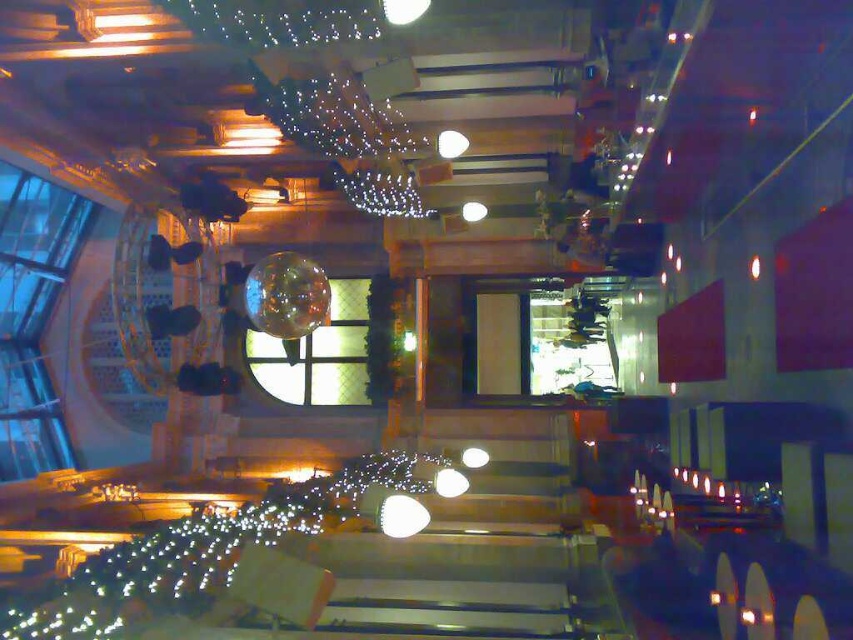
Question: Is illuminated string lights at center to the left of clear glass window at center from the viewer's perspective?

Choices:
 (A) yes
 (B) no

Answer: (B)

Question: Does illuminated string lights at center have a smaller size compared to clear glass window at center?

Choices:
 (A) no
 (B) yes

Answer: (B)

Question: Among these points, which one is nearest to the camera?

Choices:
 (A) (288, 378)
 (B) (99, 577)

Answer: (B)

Question: Does illuminated string lights at center appear on the left side of clear glass window at center?

Choices:
 (A) no
 (B) yes

Answer: (A)

Question: Which point is closer to the camera taking this photo?

Choices:
 (A) (326, 477)
 (B) (299, 356)

Answer: (A)

Question: Among these points, which one is farthest from the camera?

Choices:
 (A) (328, 374)
 (B) (427, 452)

Answer: (A)